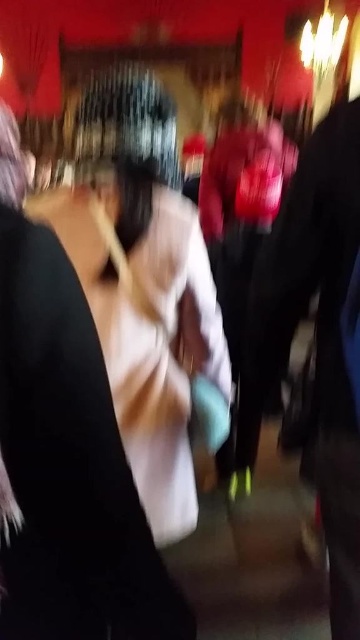
Question: Does light beige fabric bag at center appear on the right side of dark gray fabric jacket at right?

Choices:
 (A) no
 (B) yes

Answer: (A)

Question: Is light beige fabric bag at center to the right of dark gray fabric jacket at right from the viewer's perspective?

Choices:
 (A) yes
 (B) no

Answer: (B)

Question: Which of the following is the farthest from the observer?

Choices:
 (A) matte white dress at left
 (B) light beige fabric bag at center

Answer: (B)

Question: Is matte white dress at left smaller than light beige fabric bag at center?

Choices:
 (A) no
 (B) yes

Answer: (B)

Question: Which point is closer to the camera taking this photo?

Choices:
 (A) (39, 579)
 (B) (351, 401)
 (C) (192, 257)

Answer: (A)

Question: Which object is the farthest from the dark gray fabric jacket at right?

Choices:
 (A) light beige fabric bag at center
 (B) matte white dress at left

Answer: (B)